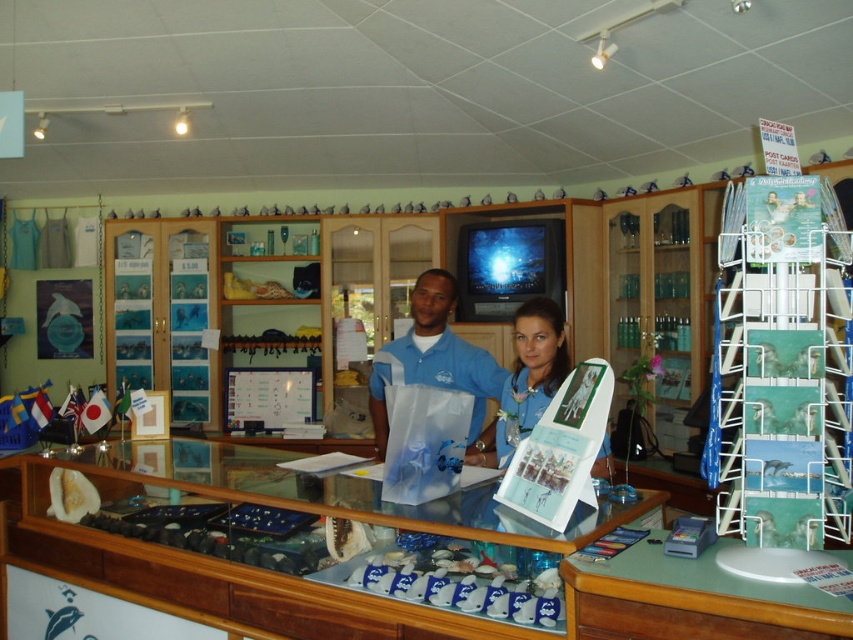
Question: Can you confirm if blue matte shirt at center is smaller than blue fabric shirt at center?

Choices:
 (A) yes
 (B) no

Answer: (B)

Question: Does blue matte shirt at center have a larger size compared to blue fabric shirt at center?

Choices:
 (A) no
 (B) yes

Answer: (B)

Question: Does blue matte shirt at center have a smaller size compared to blue fabric shirt at center?

Choices:
 (A) yes
 (B) no

Answer: (B)

Question: Which of the following is the closest to the observer?

Choices:
 (A) (438, 314)
 (B) (532, 381)

Answer: (B)